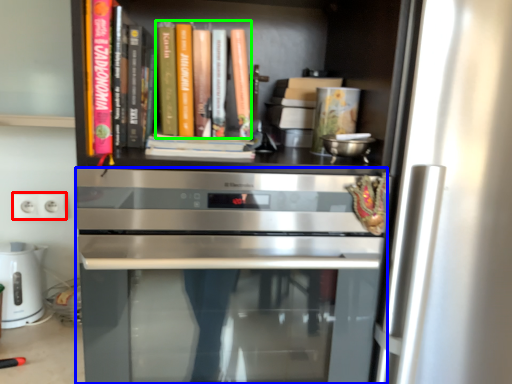
Question: Estimate the real-world distances between objects in this image. Which object is farther from electric outlet (highlighted by a red box), oven (highlighted by a blue box) or book (highlighted by a green box)?

Choices:
 (A) oven
 (B) book

Answer: (B)